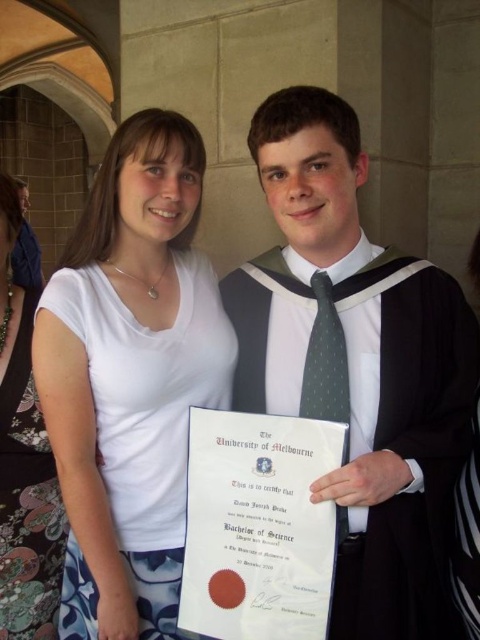
Question: Is white smooth t-shirt at center below white fabric dress at center?

Choices:
 (A) no
 (B) yes

Answer: (A)

Question: Which point is farther to the camera?

Choices:
 (A) (344, 540)
 (B) (40, 570)
 (C) (207, 394)

Answer: (B)

Question: Does white smooth t-shirt at center have a greater width compared to green dotted fabric tie at center?

Choices:
 (A) yes
 (B) no

Answer: (A)

Question: Which point is closer to the camera?

Choices:
 (A) green dotted fabric tie at center
 (B) matte black graduation gown at center
 (C) white fabric dress at center

Answer: (B)

Question: Which point appears closest to the camera in this image?

Choices:
 (A) (0, 488)
 (B) (327, 360)

Answer: (B)

Question: In this image, where is white smooth t-shirt at center located relative to green dotted fabric tie at center?

Choices:
 (A) below
 (B) above

Answer: (B)